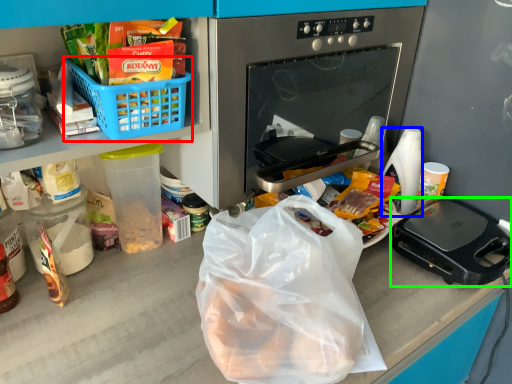
Question: Which object is positioned closest to basket (highlighted by a red box)? Select from coffee cup (highlighted by a blue box) and kitchen appliance (highlighted by a green box).

Choices:
 (A) coffee cup
 (B) kitchen appliance

Answer: (B)